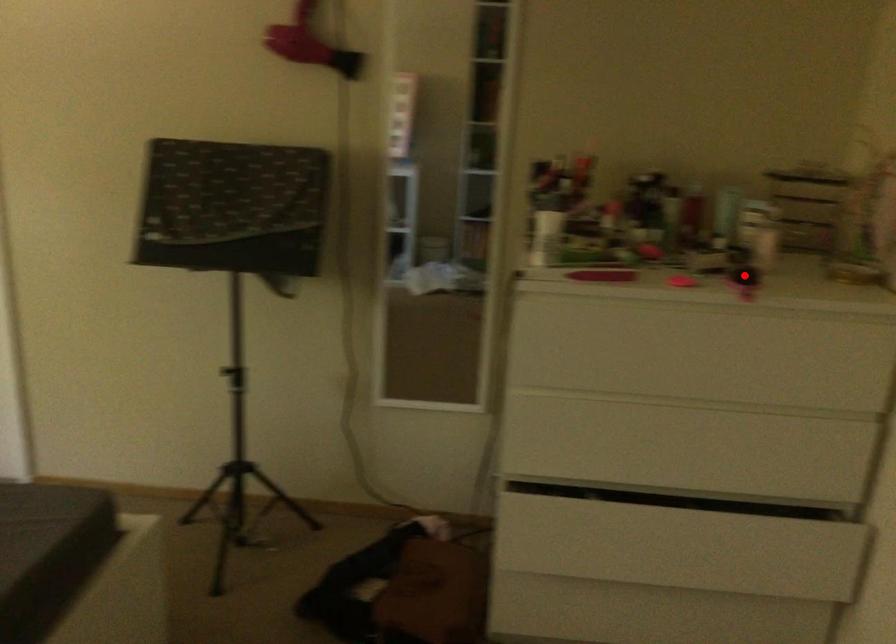
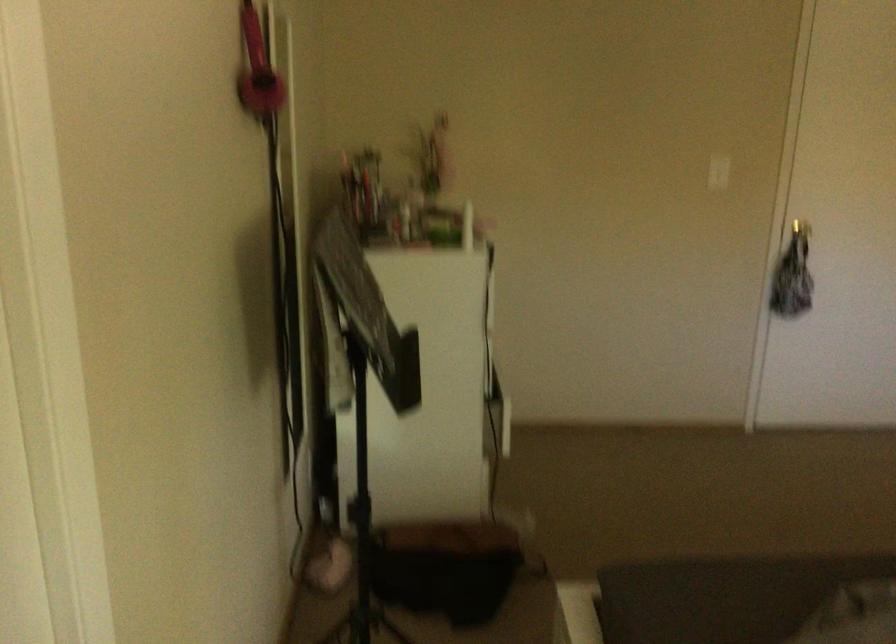
Question: I am providing you with two images of the same scene from different viewpoints. A red point is marked on the first image. Can you still see the location of the red point in image 2?

Choices:
 (A) Yes
 (B) No

Answer: (B)